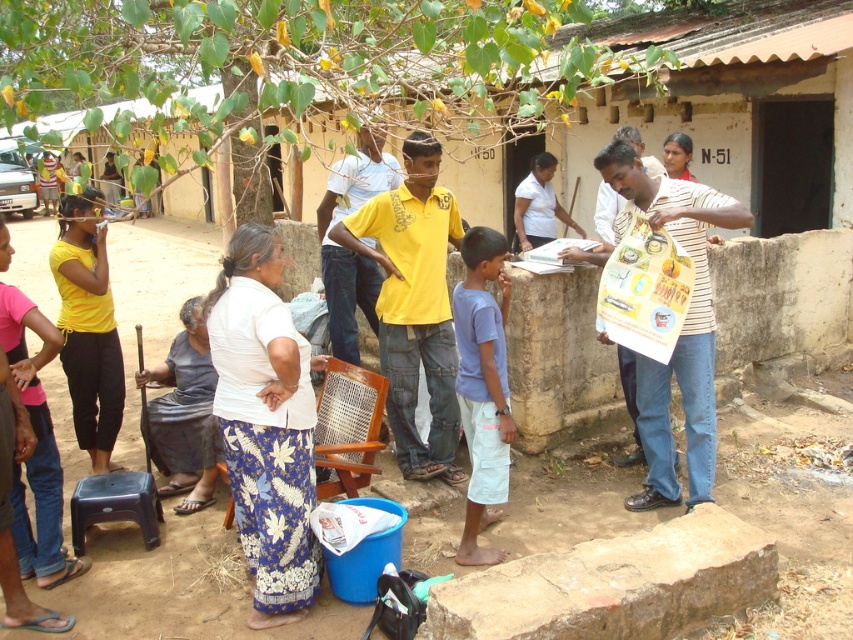
Can you confirm if white woven fabric at center is positioned to the left of matte yellow shirt at left?

In fact, white woven fabric at center is to the right of matte yellow shirt at left.

At what (x,y) coordinates should I click in order to perform the action: click on white woven fabric at center. Please return your answer as a coordinate pair (x, y). The height and width of the screenshot is (640, 853). Looking at the image, I should click on (265, 424).

Find the location of `white woven fabric at center`. white woven fabric at center is located at coordinates [265, 424].

Is white woven fabric at center positioned behind matte plastic stool at lower left?

No, it is not.

Is white woven fabric at center shorter than matte plastic stool at lower left?

Incorrect, white woven fabric at center's height does not fall short of matte plastic stool at lower left's.

Which is behind, point (253, 547) or point (74, 541)?

Point (74, 541)

Locate an element on the screen. The width and height of the screenshot is (853, 640). white woven fabric at center is located at coordinates (265, 424).

From the picture: Which of these two, matte yellow shirt at left or matte plastic stool at lower left, stands taller?

With more height is matte yellow shirt at left.

Is point (106, 422) farther from viewer compared to point (155, 497)?

Yes, it is.

Who is more forward, (83, 365) or (80, 547)?

Point (80, 547) is in front.

The height and width of the screenshot is (640, 853). I want to click on matte yellow shirt at left, so click(88, 326).